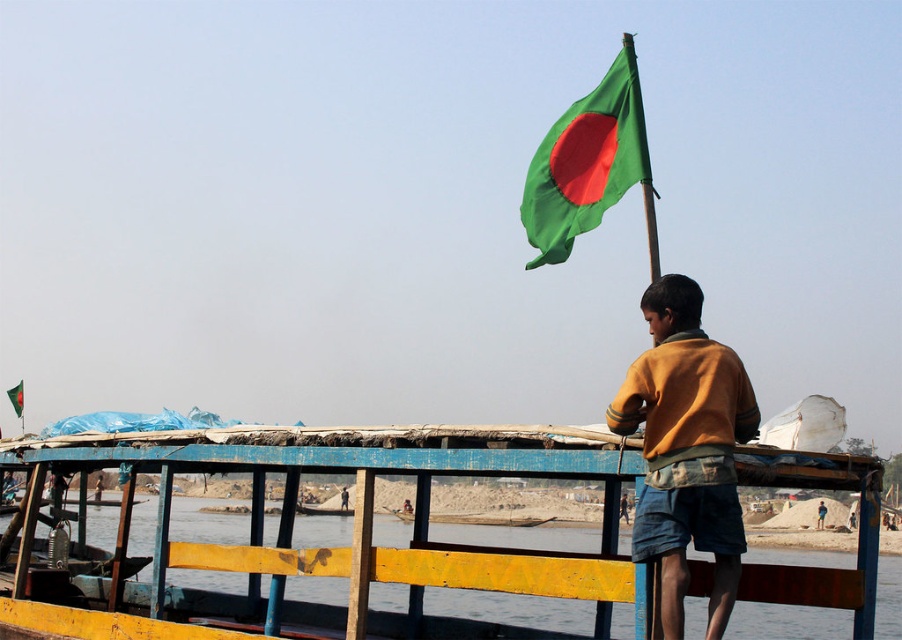
Who is more forward, [679,323] or [344,500]?

Point [679,323]

Is point (720, 403) in front of point (327, 506)?

That is True.

Image resolution: width=902 pixels, height=640 pixels. What are the coordinates of `orange cotton shirt at center` in the screenshot? It's located at (686, 449).

Is point (530, 536) behind point (15, 410)?

That is True.

Is transparent water at boat right bigger than green fabric flag at upper right?

Indeed, transparent water at boat right has a larger size compared to green fabric flag at upper right.

At what (x,y) coordinates should I click in order to perform the action: click on transparent water at boat right. Please return your answer as a coordinate pair (x, y). Looking at the image, I should click on (512, 609).

Locate an element on the screen. transparent water at boat right is located at coordinates (512, 609).

Can you confirm if green fabric flag at upper right is positioned to the left of brown cotton shirt at upper right?

Indeed, green fabric flag at upper right is positioned on the left side of brown cotton shirt at upper right.

The width and height of the screenshot is (902, 640). What do you see at coordinates (16, 397) in the screenshot? I see `green fabric flag at upper right` at bounding box center [16, 397].

Find the location of a particular element. green fabric flag at upper right is located at coordinates (16, 397).